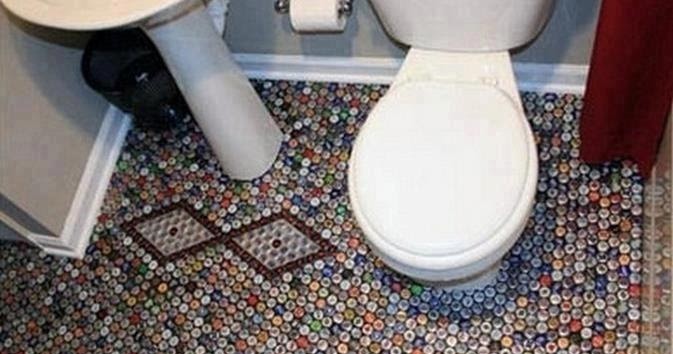
I want to click on sink basin, so click(x=98, y=21).